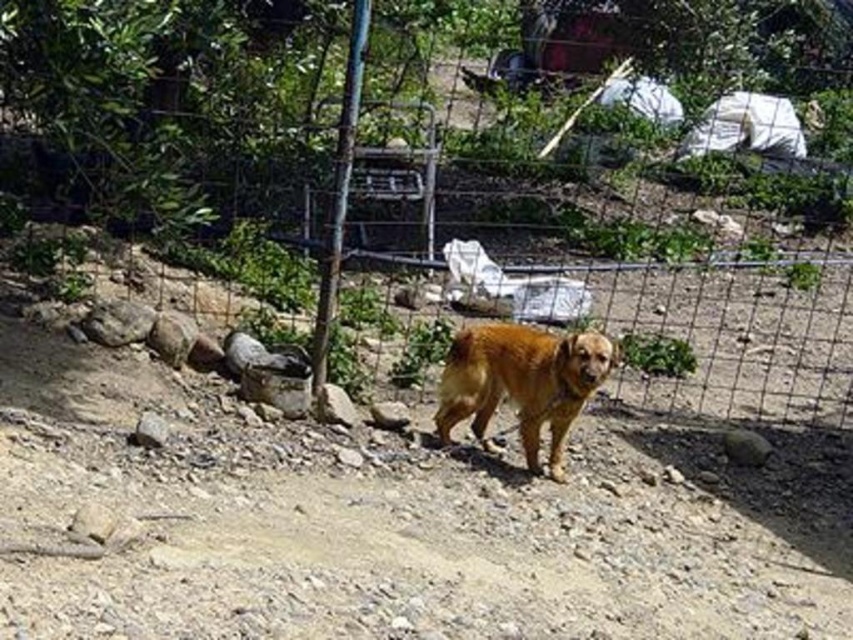
Question: Does wire mesh fence at center have a lesser width compared to golden fur dog at center?

Choices:
 (A) yes
 (B) no

Answer: (A)

Question: Which point appears farthest from the camera in this image?

Choices:
 (A) (97, 84)
 (B) (498, 520)
 (C) (515, 376)

Answer: (C)

Question: Among these objects, which one is farthest from the camera?

Choices:
 (A) golden fur dog at center
 (B) wire mesh fence at center
 (C) brown dirt field at center

Answer: (B)

Question: Does wire mesh fence at center have a greater width compared to brown dirt field at center?

Choices:
 (A) yes
 (B) no

Answer: (B)

Question: Which of these objects is positioned farthest from the wire mesh fence at center?

Choices:
 (A) brown dirt field at center
 (B) golden fur dog at center

Answer: (A)

Question: Is wire mesh fence at center positioned at the back of golden fur dog at center?

Choices:
 (A) yes
 (B) no

Answer: (A)